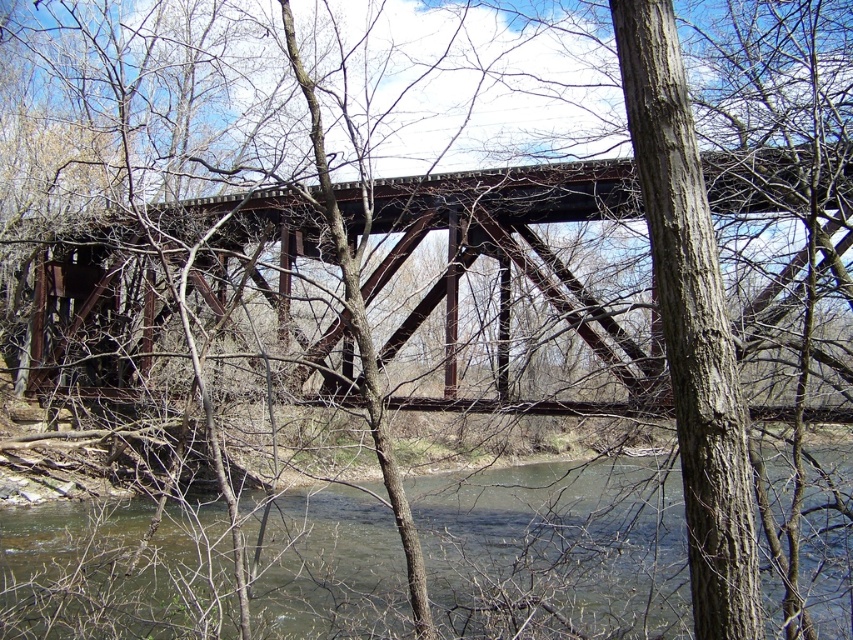
Can you confirm if greenish-brown water at lower center is taller than rusty metal bridge at center?

Incorrect, greenish-brown water at lower center's height is not larger of rusty metal bridge at center's.

Can you confirm if greenish-brown water at lower center is shorter than rusty metal bridge at center?

Correct, greenish-brown water at lower center is not as tall as rusty metal bridge at center.

Locate an element on the screen. Image resolution: width=853 pixels, height=640 pixels. greenish-brown water at lower center is located at coordinates (556, 552).